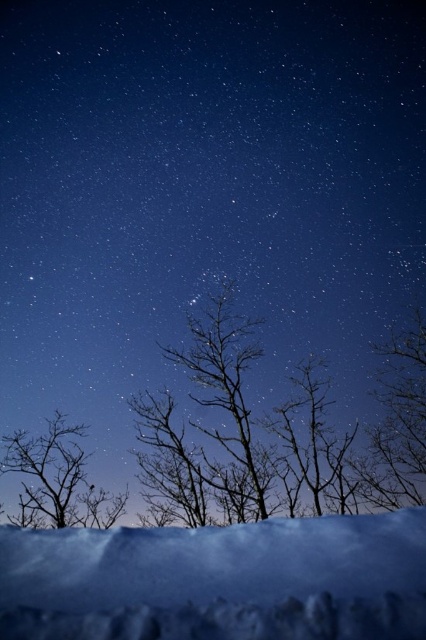
Question: Is silhouette bare tree at center closer to camera compared to silhouette bare tree at left?

Choices:
 (A) yes
 (B) no

Answer: (B)

Question: Which point is farther to the camera?

Choices:
 (A) (72, 522)
 (B) (394, 564)
 (C) (49, 476)

Answer: (A)

Question: Which point appears farthest from the camera in this image?

Choices:
 (A) (207, 586)
 (B) (63, 419)
 (C) (256, 486)

Answer: (B)

Question: Can you confirm if white fluffy snow at lower center is positioned below silhouette bare tree at left?

Choices:
 (A) no
 (B) yes

Answer: (A)

Question: Which object is farther from the camera taking this photo?

Choices:
 (A) white fluffy snow at lower center
 (B) silhouette bare tree at center

Answer: (B)

Question: Does silhouette bare tree at center appear over white fluffy snow at lower center?

Choices:
 (A) no
 (B) yes

Answer: (A)